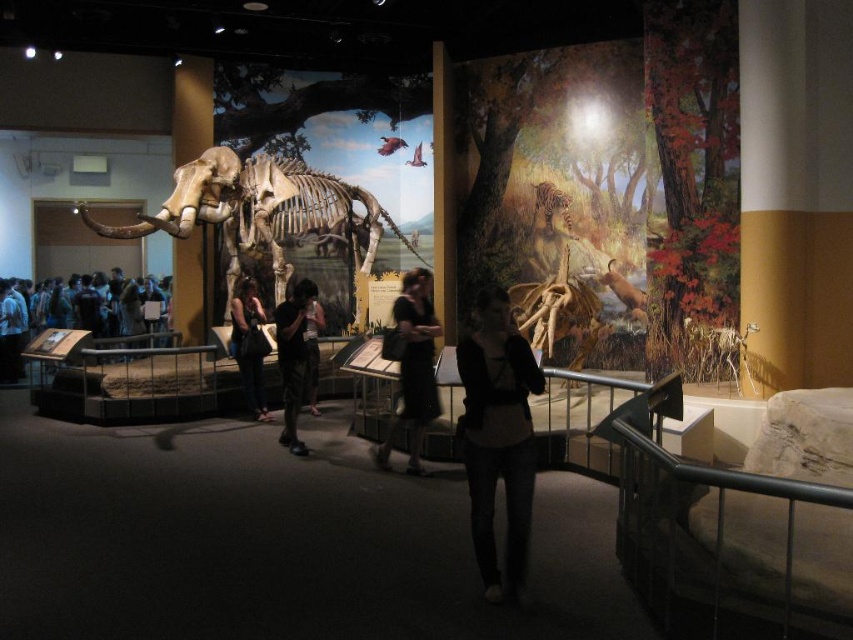
Question: Is black cotton shorts at center bigger than matte black shirt at center?

Choices:
 (A) yes
 (B) no

Answer: (A)

Question: Is matte bone-like skeleton at center to the right of black cotton shorts at center from the viewer's perspective?

Choices:
 (A) no
 (B) yes

Answer: (A)

Question: Can you confirm if matte bone-like skeleton at center is positioned to the left of matte black shirt at center?

Choices:
 (A) yes
 (B) no

Answer: (A)

Question: Estimate the real-world distances between objects in this image. Which object is closer to the black fabric dress at center?

Choices:
 (A) black cotton shorts at center
 (B) matte bone-like skeleton at center
 (C) denim jeans at center
 (D) dark blue jeans at lower left

Answer: (A)

Question: Which object appears farthest from the camera in this image?

Choices:
 (A) dark blue jeans at lower left
 (B) black fabric dress at center
 (C) matte black shirt at center
 (D) matte bone-like skeleton at center

Answer: (A)

Question: Considering the real-world distances, which object is farthest from the matte bone-like skeleton at center?

Choices:
 (A) black fabric dress at center
 (B) matte black shirt at center
 (C) dark blue jeans at lower left
 (D) black cotton shorts at center

Answer: (C)